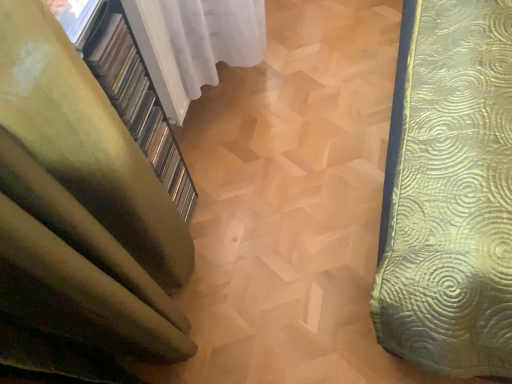
Where is `white sheer curtain at upper left, the 1th curtain when ordered from top to bottom`? This screenshot has height=384, width=512. white sheer curtain at upper left, the 1th curtain when ordered from top to bottom is located at coordinates (194, 43).

What is the approximate width of green fabric curtain at left, which appears as the 2th curtain when viewed from the top?

The width of green fabric curtain at left, which appears as the 2th curtain when viewed from the top, is 6.92 inches.

What is the approximate width of transparent glass window at upper left?

The width of transparent glass window at upper left is 15.09 centimeters.

Find the location of `white sheer curtain at upper left, the 1th curtain when ordered from top to bottom`. white sheer curtain at upper left, the 1th curtain when ordered from top to bottom is located at coordinates (194, 43).

From the image's perspective, which one is positioned higher, white sheer curtain at upper left, the 1th curtain when ordered from top to bottom, or green fabric curtain at left, which appears as the 2th curtain when viewed from the top?

white sheer curtain at upper left, the 1th curtain when ordered from top to bottom, appears higher in the image.

How different are the orientations of white sheer curtain at upper left, positioned as the second curtain in bottom-to-top order, and green fabric curtain at left, the 1th curtain in the bottom-to-top sequence, in degrees?

The angular difference between white sheer curtain at upper left, positioned as the second curtain in bottom-to-top order, and green fabric curtain at left, the 1th curtain in the bottom-to-top sequence, is 0.000486 degrees.

Can you confirm if white sheer curtain at upper left, the 1th curtain when ordered from top to bottom, is smaller than green fabric curtain at left, the 1th curtain in the bottom-to-top sequence?

Yes.

Visually, is white sheer curtain at upper left, positioned as the second curtain in bottom-to-top order, positioned to the left or to the right of green fabric curtain at left, which appears as the 2th curtain when viewed from the top?

white sheer curtain at upper left, positioned as the second curtain in bottom-to-top order, is to the right of green fabric curtain at left, which appears as the 2th curtain when viewed from the top.

Which object is further away from the camera taking this photo, transparent glass window at upper left or green fabric curtain at left, the 1th curtain in the bottom-to-top sequence?

transparent glass window at upper left is further from the camera.

Does transparent glass window at upper left appear on the right side of green fabric curtain at left, which appears as the 2th curtain when viewed from the top?

Incorrect, transparent glass window at upper left is not on the right side of green fabric curtain at left, which appears as the 2th curtain when viewed from the top.

Is green fabric curtain at left, the 1th curtain in the bottom-to-top sequence, surrounded by transparent glass window at upper left?

No, green fabric curtain at left, the 1th curtain in the bottom-to-top sequence, is not surrounded by transparent glass window at upper left.

From a real-world perspective, which object rests below the other?

From a 3D spatial view, white sheer curtain at upper left, positioned as the second curtain in bottom-to-top order, is below.

Is green fabric curtain at left, which appears as the 2th curtain when viewed from the top, oriented away from white sheer curtain at upper left, the 1th curtain when ordered from top to bottom?

No, green fabric curtain at left, which appears as the 2th curtain when viewed from the top, is not facing away from white sheer curtain at upper left, the 1th curtain when ordered from top to bottom.

From the image's perspective, which is above, green fabric curtain at left, which appears as the 2th curtain when viewed from the top, or white sheer curtain at upper left, positioned as the second curtain in bottom-to-top order?

white sheer curtain at upper left, positioned as the second curtain in bottom-to-top order, from the image's perspective.

Could you measure the distance between green fabric curtain at left, the 1th curtain in the bottom-to-top sequence, and white sheer curtain at upper left, positioned as the second curtain in bottom-to-top order?

They are 24.81 inches apart.

How far apart are white sheer curtain at upper left, the 1th curtain when ordered from top to bottom, and transparent glass window at upper left?

A distance of 22.83 inches exists between white sheer curtain at upper left, the 1th curtain when ordered from top to bottom, and transparent glass window at upper left.

Considering the relative positions of white sheer curtain at upper left, positioned as the second curtain in bottom-to-top order, and transparent glass window at upper left in the image provided, is white sheer curtain at upper left, positioned as the second curtain in bottom-to-top order, to the left of transparent glass window at upper left from the viewer's perspective?

No, white sheer curtain at upper left, positioned as the second curtain in bottom-to-top order, is not to the left of transparent glass window at upper left.

Which of these two, white sheer curtain at upper left, positioned as the second curtain in bottom-to-top order, or transparent glass window at upper left, is wider?

Wider between the two is transparent glass window at upper left.

Which of these two, green fabric curtain at left, the 1th curtain in the bottom-to-top sequence, or transparent glass window at upper left, stands taller?

green fabric curtain at left, the 1th curtain in the bottom-to-top sequence, is taller.

Can you confirm if green fabric curtain at left, which appears as the 2th curtain when viewed from the top, is smaller than transparent glass window at upper left?

No.

The height and width of the screenshot is (384, 512). I want to click on window located behind the green fabric curtain at left, which appears as the 2th curtain when viewed from the top, so click(x=75, y=17).

Based on the photo, is green fabric curtain at left, the 1th curtain in the bottom-to-top sequence, surrounding transparent glass window at upper left?

Yes, transparent glass window at upper left is inside green fabric curtain at left, the 1th curtain in the bottom-to-top sequence.

Is transparent glass window at upper left positioned with its back to white sheer curtain at upper left, the 1th curtain when ordered from top to bottom?

No.

Where is `the 2nd curtain counting from the right side of the transparent glass window at upper left`? The image size is (512, 384). the 2nd curtain counting from the right side of the transparent glass window at upper left is located at coordinates (194, 43).

Which object is wider, transparent glass window at upper left or white sheer curtain at upper left, the 1th curtain when ordered from top to bottom?

With larger width is transparent glass window at upper left.

Image resolution: width=512 pixels, height=384 pixels. I want to click on curtain that is under the green fabric curtain at left, which appears as the 2th curtain when viewed from the top (from a real-world perspective), so click(x=194, y=43).

Identify the location of curtain in front of the transparent glass window at upper left. (79, 218).

Which object lies nearer to the anchor point green fabric curtain at left, which appears as the 2th curtain when viewed from the top, white sheer curtain at upper left, positioned as the second curtain in bottom-to-top order, or transparent glass window at upper left?

transparent glass window at upper left lies closer to green fabric curtain at left, which appears as the 2th curtain when viewed from the top, than the other object.

Looking at the image, which one is located further to white sheer curtain at upper left, the 1th curtain when ordered from top to bottom, transparent glass window at upper left or green fabric curtain at left, the 1th curtain in the bottom-to-top sequence?

Based on the image, green fabric curtain at left, the 1th curtain in the bottom-to-top sequence, appears to be further to white sheer curtain at upper left, the 1th curtain when ordered from top to bottom.

Estimate the real-world distances between objects in this image. Which object is closer to white sheer curtain at upper left, the 1th curtain when ordered from top to bottom, green fabric curtain at left, the 1th curtain in the bottom-to-top sequence, or transparent glass window at upper left?

The object closer to white sheer curtain at upper left, the 1th curtain when ordered from top to bottom, is transparent glass window at upper left.

From the image, which object appears to be farther from green fabric curtain at left, which appears as the 2th curtain when viewed from the top, transparent glass window at upper left or white sheer curtain at upper left, positioned as the second curtain in bottom-to-top order?

The object further to green fabric curtain at left, which appears as the 2th curtain when viewed from the top, is white sheer curtain at upper left, positioned as the second curtain in bottom-to-top order.

Which object lies further to the anchor point transparent glass window at upper left, white sheer curtain at upper left, the 1th curtain when ordered from top to bottom, or green fabric curtain at left, which appears as the 2th curtain when viewed from the top?

white sheer curtain at upper left, the 1th curtain when ordered from top to bottom, is further to transparent glass window at upper left.

Which object lies nearer to the anchor point transparent glass window at upper left, green fabric curtain at left, which appears as the 2th curtain when viewed from the top, or white sheer curtain at upper left, the 1th curtain when ordered from top to bottom?

A: Based on the image, green fabric curtain at left, which appears as the 2th curtain when viewed from the top, appears to be nearer to transparent glass window at upper left.

Locate an element on the screen. window between white sheer curtain at upper left, positioned as the second curtain in bottom-to-top order, and green fabric curtain at left, which appears as the 2th curtain when viewed from the top, vertically is located at coordinates (75, 17).